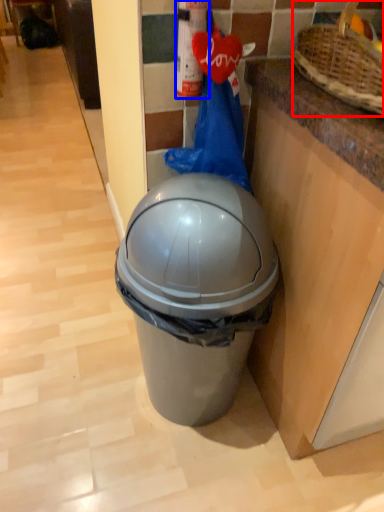
Question: Which object appears farthest to the camera in this image, basket (highlighted by a red box) or extinguisher (highlighted by a blue box)?

Choices:
 (A) basket
 (B) extinguisher

Answer: (B)